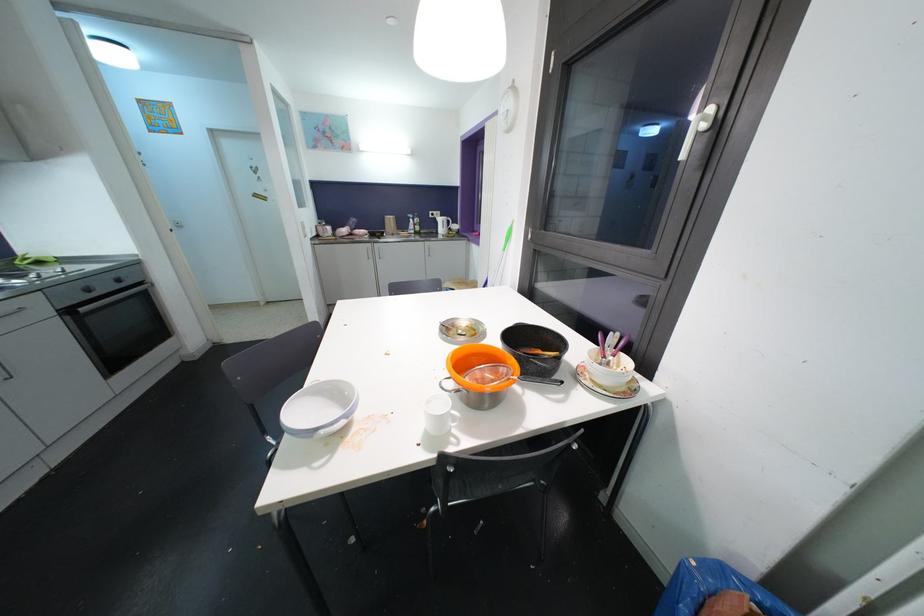
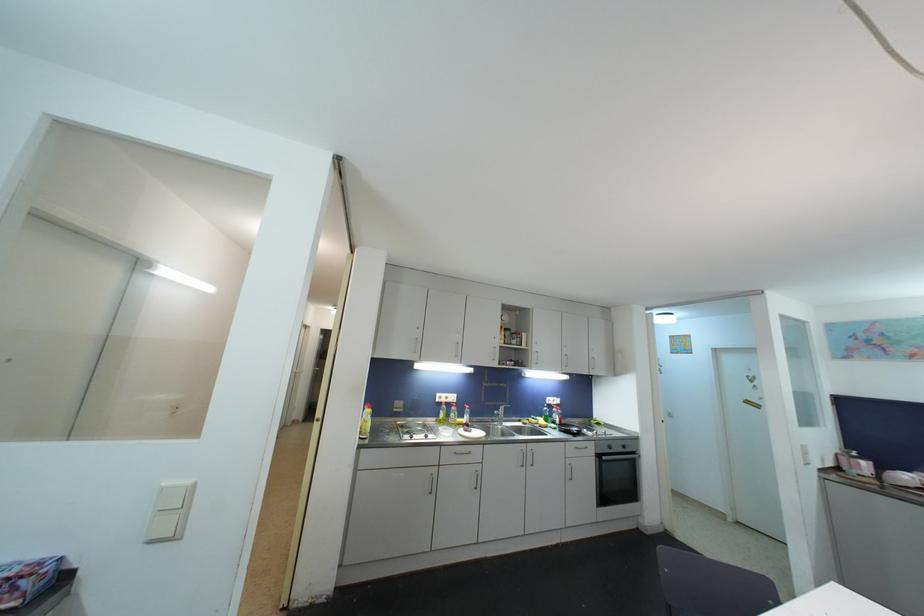
Locate, in the second image, the point that corresponds to [116,278] in the first image.

(625, 445)